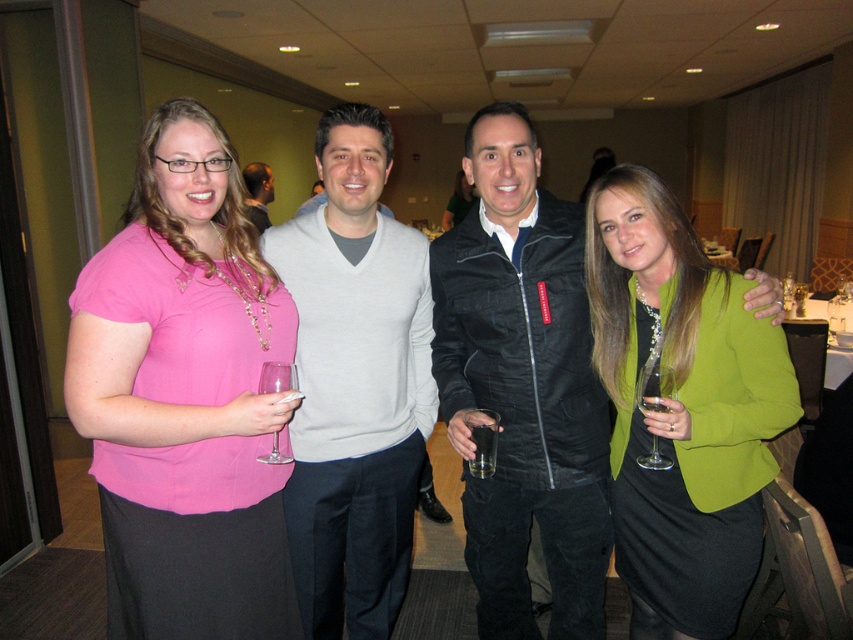
Who is shorter, clear glass wine glass at lower right or matte gray sweater at center?

clear glass wine glass at lower right is shorter.

Who is positioned more to the right, clear glass wine glass at lower right or matte gray sweater at center?

Positioned to the right is clear glass wine glass at lower right.

Who is more forward, (653, 374) or (245, 184)?

Point (653, 374) is in front.

Locate an element on the screen. The height and width of the screenshot is (640, 853). clear glass wine glass at lower right is located at coordinates (654, 385).

Is green matte blazer at center closer to camera compared to clear glass at center?

Yes, green matte blazer at center is in front of clear glass at center.

This screenshot has height=640, width=853. I want to click on green matte blazer at center, so click(682, 408).

Is black leather jacket at center further to camera compared to clear glass at center?

Yes, black leather jacket at center is behind clear glass at center.

Which of these two, black leather jacket at center or clear glass at center, stands shorter?

clear glass at center

Between point (463, 241) and point (485, 436), which one is positioned behind?

Point (463, 241)

Where is `black leather jacket at center`? The height and width of the screenshot is (640, 853). black leather jacket at center is located at coordinates (521, 385).